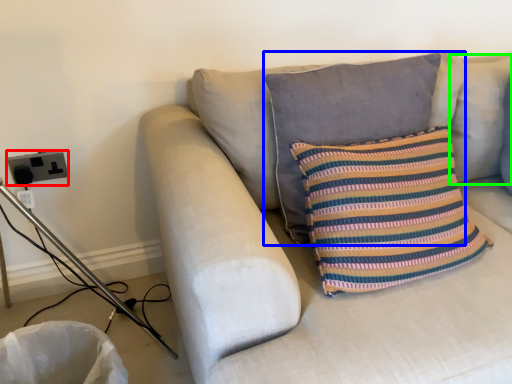
Question: Based on their relative distances, which object is nearer to electric outlet (highlighted by a red box)? Choose from pillow (highlighted by a blue box) and pillow (highlighted by a green box).

Choices:
 (A) pillow
 (B) pillow

Answer: (A)